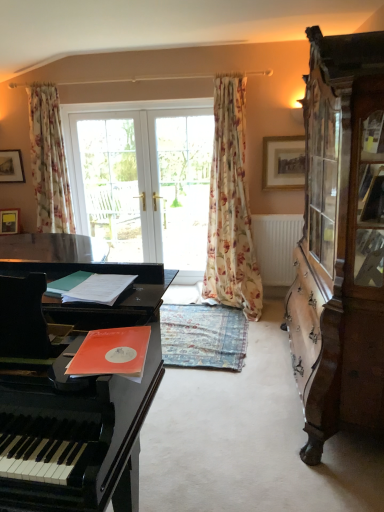
At what (x,y) coordinates should I click in order to perform the action: click on free point above white matte radiator at center (from a real-world perspective). Please return your answer as a coordinate pair (x, y). Image resolution: width=384 pixels, height=512 pixels. Looking at the image, I should click on pos(276,211).